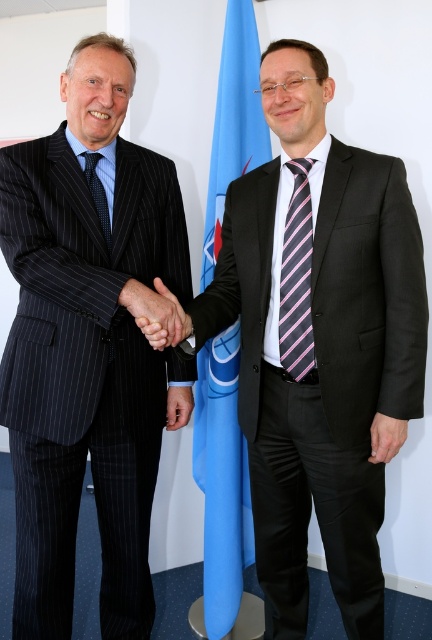
Is matte black suit at center smaller than matte blue shirt at center?

No, matte black suit at center is not smaller than matte blue shirt at center.

Measure the distance between matte black suit at center and camera.

matte black suit at center is 1.26 meters from camera.

Where is `matte black suit at center`? matte black suit at center is located at coordinates (317, 340).

Between blue fabric flag at center and matte black hand at center, which one appears on the right side from the viewer's perspective?

From the viewer's perspective, matte black hand at center appears more on the right side.

Measure the distance between blue fabric flag at center and matte black hand at center.

The distance of blue fabric flag at center from matte black hand at center is 28.36 inches.

Does point (209, 164) lie behind point (374, 449)?

Yes, it is.

Find the location of `blue fabric flag at center`. blue fabric flag at center is located at coordinates (222, 493).

Does pink striped tie at center appear over matte black hand at center?

Yes.

Is pink striped tie at center bigger than matte black hand at center?

Indeed, pink striped tie at center has a larger size compared to matte black hand at center.

Is point (308, 202) farther from viewer compared to point (390, 422)?

Yes, point (308, 202) is farther from viewer.

The width and height of the screenshot is (432, 640). Find the location of `pink striped tie at center`. pink striped tie at center is located at coordinates (297, 276).